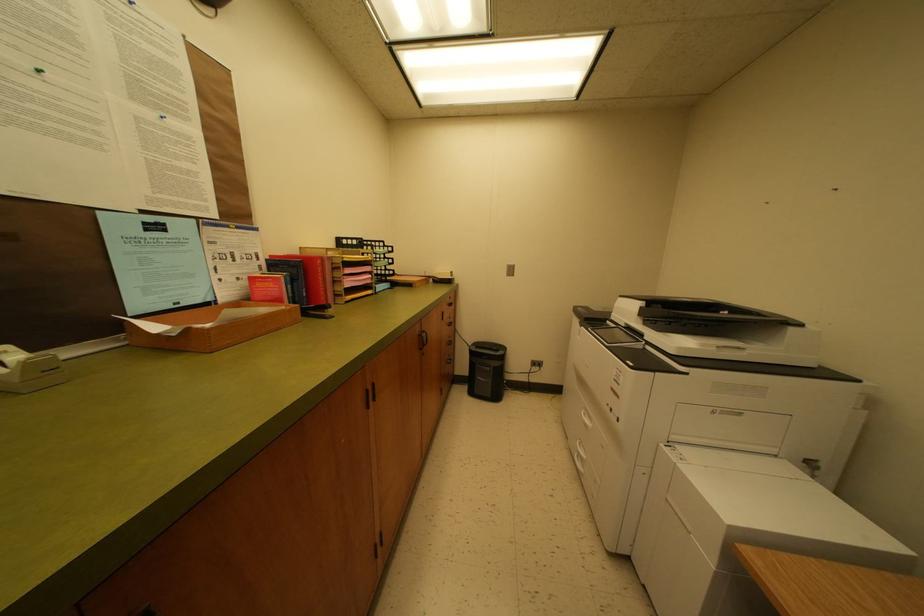
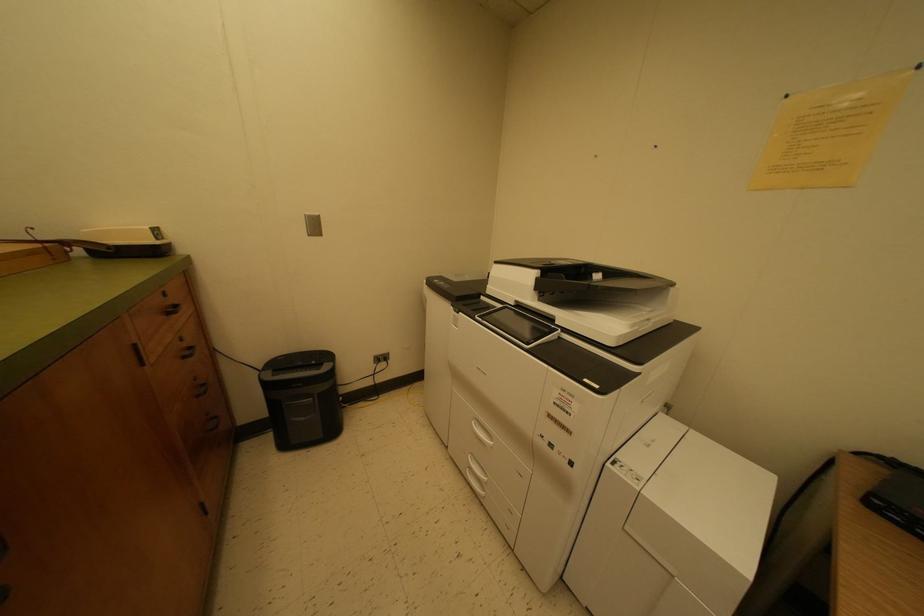
Question: The camera is either moving clockwise (left) or counter-clockwise (right) around the object. The first image is from the beginning of the video and the second image is from the end. Is the camera moving left or right when shooting the video?

Choices:
 (A) Left
 (B) Right

Answer: (A)